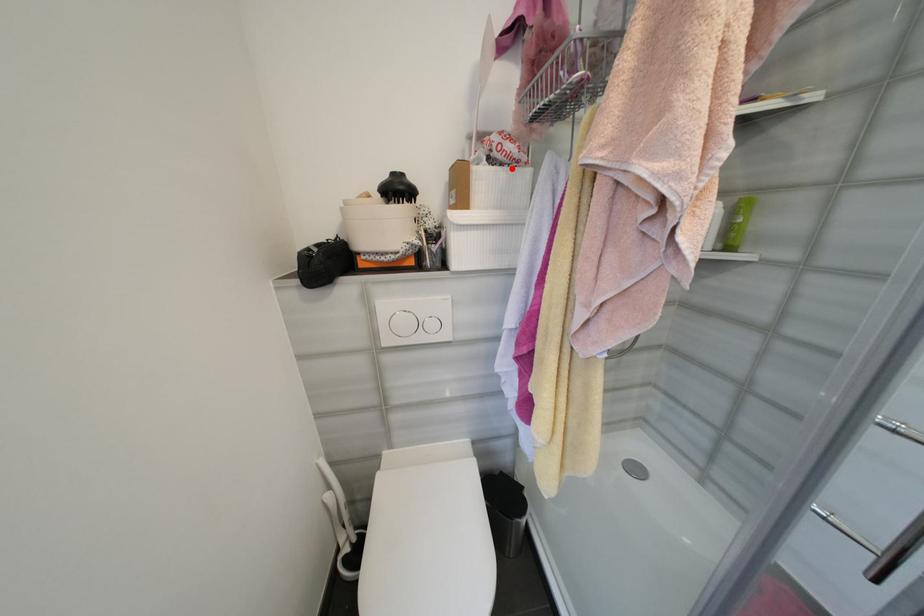
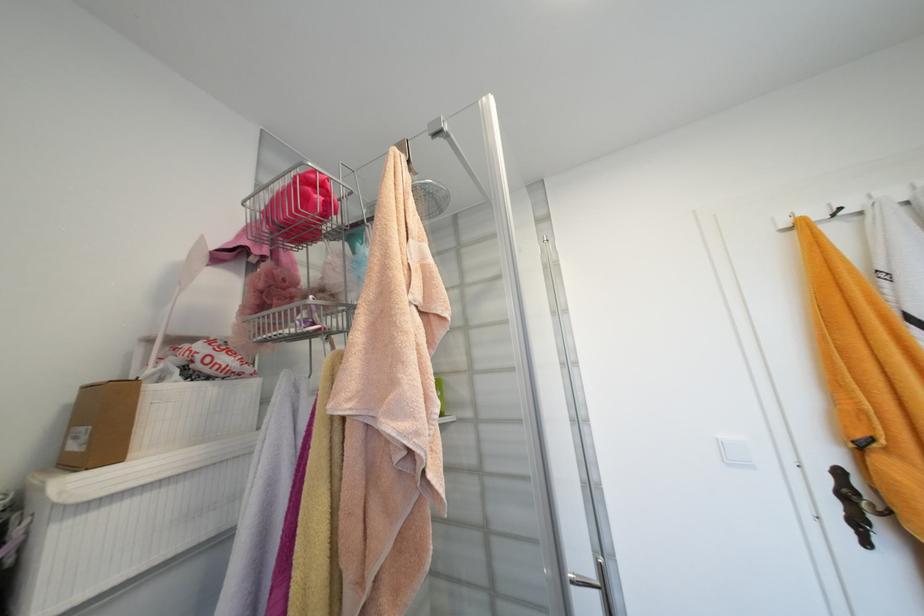
The point at the highlighted location is marked in the first image. Where is the corresponding point in the second image?

(224, 383)